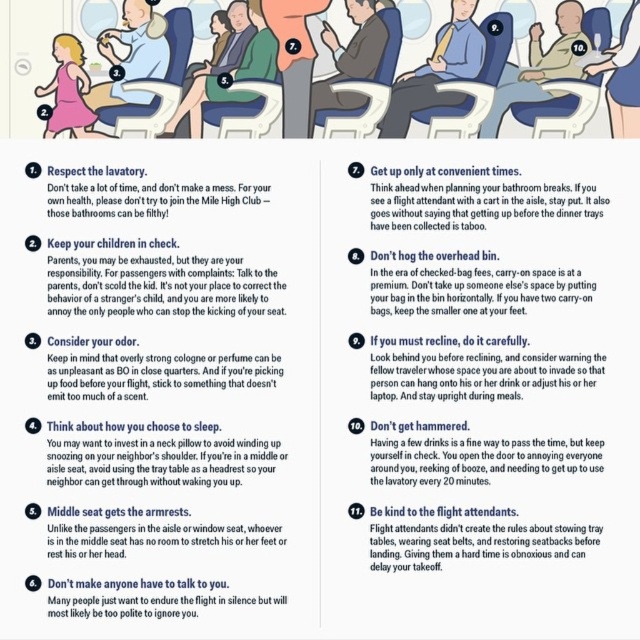
Between matte black text at upper center and matte blue shirt at center, which one has more height?

matte blue shirt at center is taller.

Who is positioned more to the left, matte black text at upper center or matte blue shirt at center?

matte blue shirt at center is more to the left.

Which is behind, point (376, 211) or point (404, 120)?

The point (376, 211) is more distant.

Where is `matte black text at upper center`? The image size is (640, 640). matte black text at upper center is located at coordinates (476, 204).

Who is taller, matte black text at upper left or light beige leather jacket at upper right?

matte black text at upper left

Identify the location of matte black text at upper left. The width and height of the screenshot is (640, 640). (154, 282).

Can you confirm if matte blue shirt at center is positioned to the right of pink satin dress at upper left?

Indeed, matte blue shirt at center is positioned on the right side of pink satin dress at upper left.

Who is positioned more to the right, matte blue shirt at center or pink satin dress at upper left?

From the viewer's perspective, matte blue shirt at center appears more on the right side.

Identify the location of matte blue shirt at center. (436, 72).

Find the location of `matte blue shirt at center`. matte blue shirt at center is located at coordinates (436, 72).